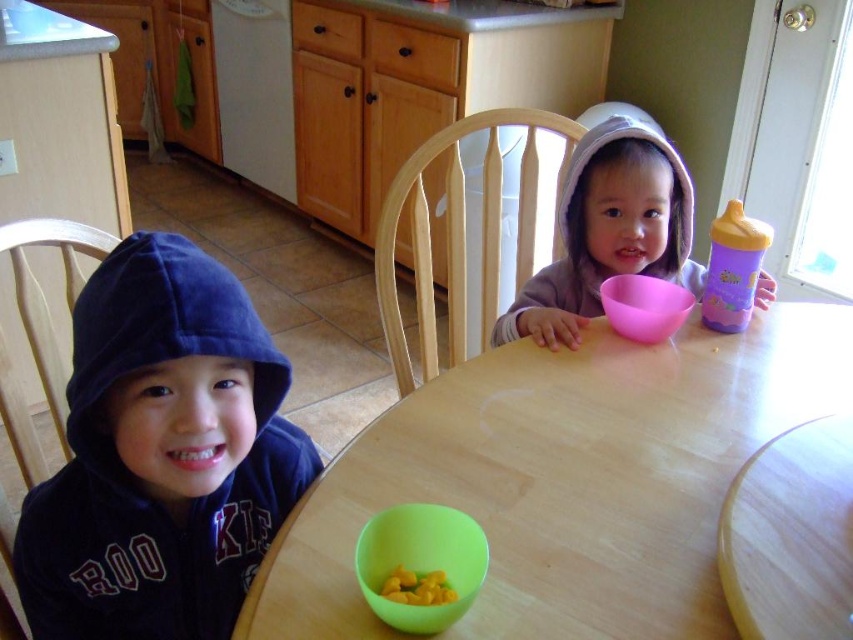
You are a parent trying to place a new toy between the wooden table at center and the velvet blue hoodie at left. Based on their positions, which object should you place the toy closer to in order to keep it between them?

The wooden table at center is positioned on the right side of velvet blue hoodie at left. To place the toy between them, you should position it closer to the velvet blue hoodie at left since the table is to its right.

You are a photographer standing at a distance of 20 inches from the wooden table at center. Can you reach the table without moving your position?

The wooden table at center is 22.76 inches from the camera, which is further than your current distance of 20 inches. Therefore, you cannot reach the table without moving closer.

You are a parent trying to place a toy on the table between the two children. The toy needs to be placed exactly halfway between point A at point (622, 273) and point B at point (456, 236). Where should you place the toy?

The toy should be placed at the midpoint between point A at (622, 273) and point B at (456, 236). To calculate this, average the x and y coordinates separately. The midpoint would be at x coordinate 0.428 and 0.369 divided by 2 equals 0.3985, and y coordinate 0.730 and 0.536 divided by 2 equals 0.633. So the toy should be placed at approximately point 0.399, 0.633.